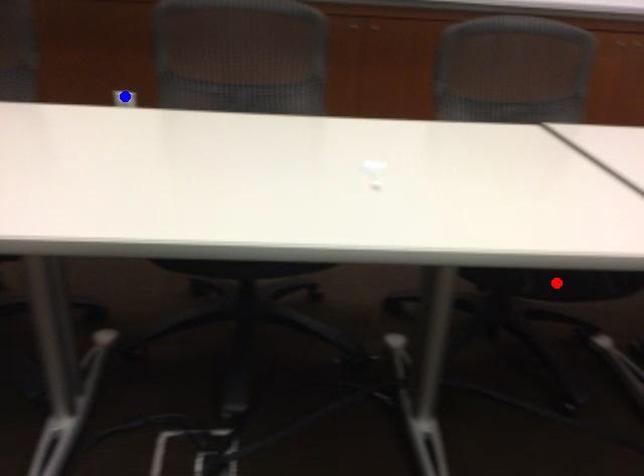
Question: Two points are marked on the image. Which point is closer to the camera?

Choices:
 (A) Blue point is closer.
 (B) Red point is closer.

Answer: (B)